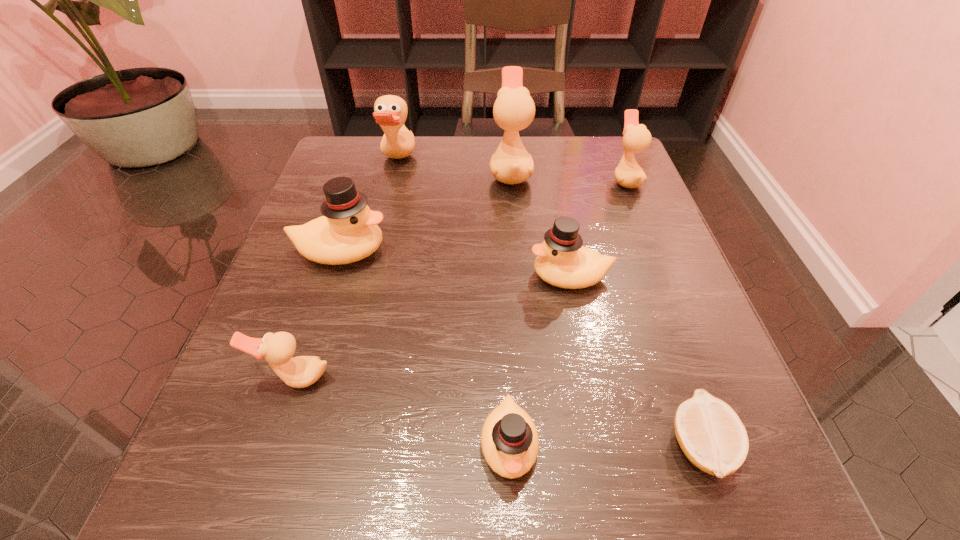
The height and width of the screenshot is (540, 960). Find the location of `the tallest duck`. the tallest duck is located at coordinates (514, 109).

Identify the location of the tallest object. (514, 109).

Identify the location of the third smallest tan duck. (390, 112).

This screenshot has height=540, width=960. Identify the location of the leftmost yellow duck. (348, 232).

Identify the location of the rightmost tan duck. This screenshot has height=540, width=960. (636, 138).

Identify the location of the rightmost duck. (636, 138).

I want to click on the rightmost yellow duck, so click(562, 261).

Identify the location of the nearest tan duck. The image size is (960, 540). (278, 348).

Identify the location of the smallest tan duck. This screenshot has height=540, width=960. (278, 348).

You are a GUI agent. You are given a task and a screenshot of the screen. Output one action in this format:
    pyautogui.click(x=<x>, y=<y>)
    Task: Click on the nearest yellow duck
    
    Given the screenshot: What is the action you would take?
    pyautogui.click(x=509, y=439)